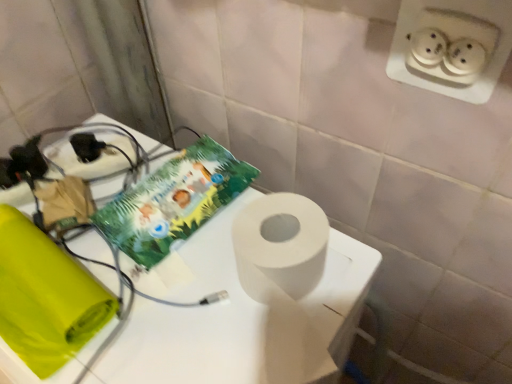
The width and height of the screenshot is (512, 384). Describe the element at coordinates (173, 201) in the screenshot. I see `green paper comic book at upper center` at that location.

Find the location of a particular element. The width and height of the screenshot is (512, 384). green paper comic book at upper center is located at coordinates (173, 201).

I want to click on white matte table at center, so [x=239, y=316].

Image resolution: width=512 pixels, height=384 pixels. What do you see at coordinates (239, 316) in the screenshot?
I see `white matte table at center` at bounding box center [239, 316].

This screenshot has width=512, height=384. In order to click on green paper comic book at upper center in this screenshot , I will do `click(173, 201)`.

Considering the relative positions of green paper comic book at upper center and white matte table at center in the image provided, is green paper comic book at upper center to the left of white matte table at center from the viewer's perspective?

Incorrect, green paper comic book at upper center is not on the left side of white matte table at center.

Which object is closer to the camera taking this photo, green paper comic book at upper center or white matte table at center?

white matte table at center is more forward.

Does point (153, 235) come behind point (326, 265)?

Yes.

From the image's perspective, which one is positioned higher, green paper comic book at upper center or white matte table at center?

From the image's view, green paper comic book at upper center is above.

From a real-world perspective, relative to white matte table at center, is green paper comic book at upper center vertically above or below?

green paper comic book at upper center is above white matte table at center.

In the scene shown: Is green paper comic book at upper center wider or thinner than white matte table at center?

Considering their sizes, green paper comic book at upper center looks slimmer than white matte table at center.

Based on the photo, does green paper comic book at upper center have a greater height compared to white matte table at center?

No, green paper comic book at upper center is not taller than white matte table at center.

Between green paper comic book at upper center and white matte table at center, which one has smaller size?

green paper comic book at upper center is smaller.

From the picture: Can we say green paper comic book at upper center lies outside white matte table at center?

No, most part of green paper comic book at upper center lies within white matte table at center.

Is green paper comic book at upper center with white matte table at center?

There is a gap between green paper comic book at upper center and white matte table at center.

Is white matte table at center at the back of green paper comic book at upper center?

Yes, white matte table at center is at the back of green paper comic book at upper center.

Can you tell me how much green paper comic book at upper center and white matte table at center differ in facing direction?

Answer: The facing directions of green paper comic book at upper center and white matte table at center are 6.57 degrees apart.

Measure the distance from green paper comic book at upper center to white matte table at center.

green paper comic book at upper center is 4.34 inches from white matte table at center.

The image size is (512, 384). In the image, there is a green paper comic book at upper center. In order to click on table below it (from a real-world perspective) in this screenshot , I will do `click(239, 316)`.

Would you say white matte table at center is to the left or to the right of green paper comic book at upper center in the picture?

In the image, white matte table at center appears on the left side of green paper comic book at upper center.

Which object is closer to the camera, white matte table at center or green paper comic book at upper center?

white matte table at center is more forward.

Which point is more forward, (285, 332) or (181, 207)?

Positioned in front is point (285, 332).

From the image's perspective, is white matte table at center located above green paper comic book at upper center?

Actually, white matte table at center appears below green paper comic book at upper center in the image.

From a real-world perspective, is white matte table at center on green paper comic book at upper center?

No, from a real-world perspective, white matte table at center is not over green paper comic book at upper center

Considering the sizes of objects white matte table at center and green paper comic book at upper center in the image provided, who is wider, white matte table at center or green paper comic book at upper center?

white matte table at center is wider.

Considering the relative sizes of white matte table at center and green paper comic book at upper center in the image provided, is white matte table at center taller than green paper comic book at upper center?

Correct, white matte table at center is much taller as green paper comic book at upper center.

Can you confirm if white matte table at center is bigger than green paper comic book at upper center?

Indeed, white matte table at center has a larger size compared to green paper comic book at upper center.

Consider the image. Is white matte table at center inside or outside of green paper comic book at upper center?

The correct answer is: outside.

Is white matte table at center in contact with green paper comic book at upper center?

No, white matte table at center is not making contact with green paper comic book at upper center.

Is green paper comic book at upper center at the back of white matte table at center?

No, white matte table at center is not facing away from green paper comic book at upper center.

Measure the distance between white matte table at center and green paper comic book at upper center.

They are 4.34 inches apart.

This screenshot has height=384, width=512. I want to click on table that appears below the green paper comic book at upper center (from the image's perspective), so click(239, 316).

Where is `comic book behind the white matte table at center`? The width and height of the screenshot is (512, 384). comic book behind the white matte table at center is located at coordinates click(173, 201).

Find the location of `table that appears on the left of green paper comic book at upper center`. table that appears on the left of green paper comic book at upper center is located at coordinates (239, 316).